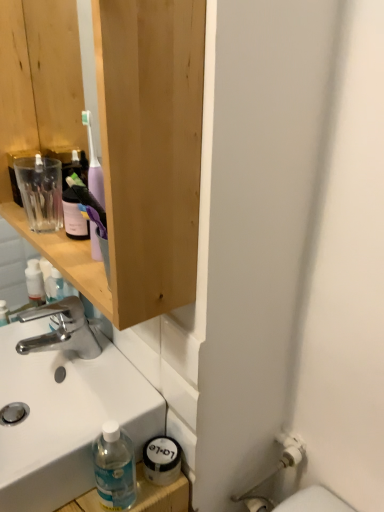
At what (x,y) coordinates should I click in order to perform the action: click on free space above white glossy sink at lower left (from a real-world perspective). Please return your answer as a coordinate pair (x, y). Looking at the image, I should click on (88, 368).